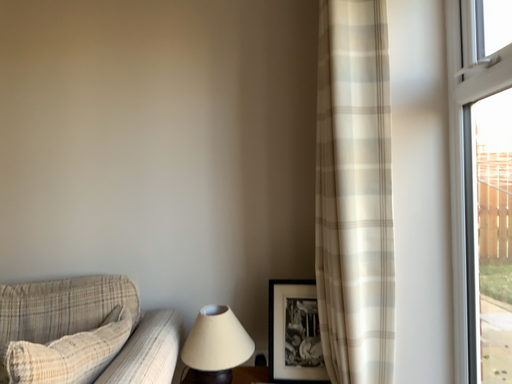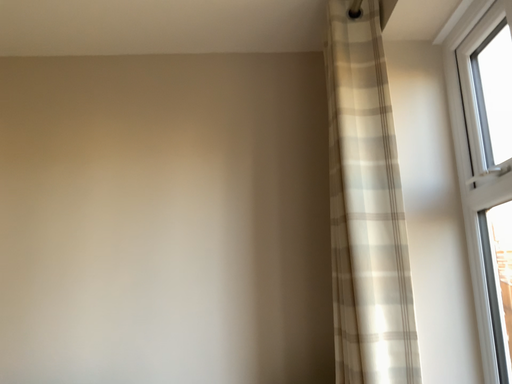
Question: How did the camera likely rotate when shooting the video?

Choices:
 (A) rotated upward
 (B) rotated downward

Answer: (A)